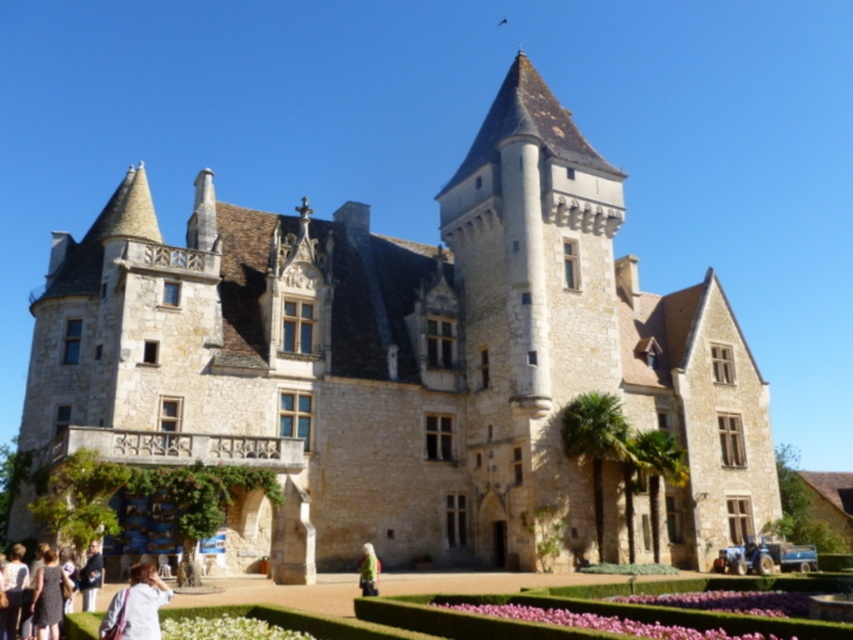
You are standing at the entrance of the grand medieval stone building and see a dark brown leather jacket at lower left. There is a bench 10 feet away from you. Can you reach the jacket without passing the bench?

The dark brown leather jacket at lower left is 106.49 feet away from you. Since the bench is only 10 feet away, you would have to pass the bench to reach the jacket.

You are a visitor standing in front of the grand medieval stone building and notice two plants in front of it. The pink floral bed at lower center and the white matte flower at lower center. Which one is taller?

The pink floral bed at lower center is taller than the white matte flower at lower center.

You are standing in front of the grand medieval stone building and see the dark brown leather jacket at lower left. If you want to pick it up, where exactly should you look? Please provide coordinates in the format of x,y where x and y are between 0 and 1, with 0,0 being the bottom left corner of the image.

The dark brown leather jacket at lower left is located at coordinates (49, 596).